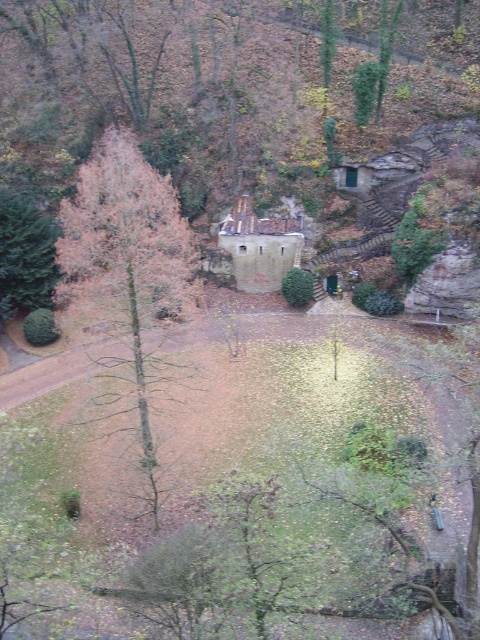
You are standing at the point marked as point [393,76] in the image. If you want to walk towards the rustic stone building, which direction should you move relative to your current position?

Since the point [393,76] is 191.63 feet away from the viewer, you should move towards the building by heading in the direction opposite to where you are currently facing.